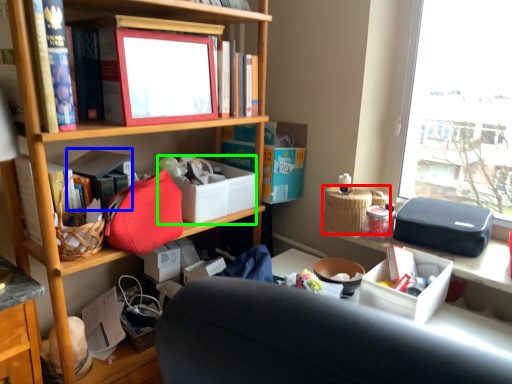
Question: Which object is the farthest from picnic basket (highlighted by a red box)? Choose among these: book (highlighted by a blue box) or storage box (highlighted by a green box).

Choices:
 (A) book
 (B) storage box

Answer: (A)